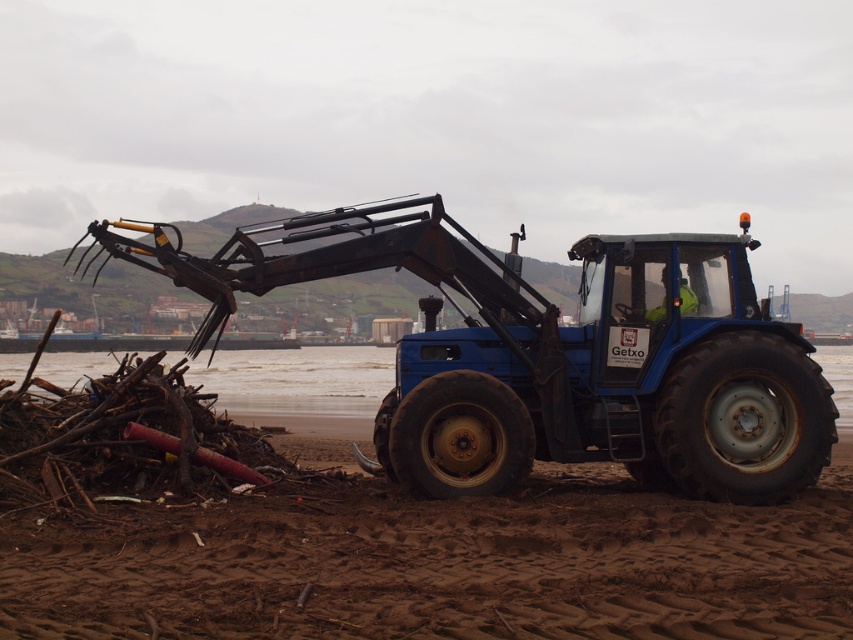
Question: Among these objects, which one is nearest to the camera?

Choices:
 (A) blue matte tractor at center
 (B) brown sandy beach at lower center

Answer: (B)

Question: In this image, where is brown sandy beach at lower center located relative to blue matte tractor at center?

Choices:
 (A) left
 (B) right

Answer: (A)

Question: Which of the following is the closest to the observer?

Choices:
 (A) blue matte tractor at center
 (B) brown sandy beach at lower center

Answer: (B)

Question: Does brown sandy beach at lower center have a greater width compared to blue matte tractor at center?

Choices:
 (A) no
 (B) yes

Answer: (A)

Question: Observing the image, what is the correct spatial positioning of brown sandy beach at lower center in reference to blue matte tractor at center?

Choices:
 (A) below
 (B) above

Answer: (A)

Question: Which object appears farthest from the camera in this image?

Choices:
 (A) brown sandy beach at lower center
 (B) blue matte tractor at center

Answer: (B)